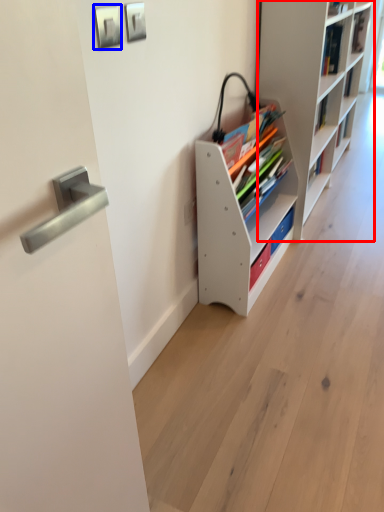
Question: Which object is further to the camera taking this photo, shelf (highlighted by a red box) or picture frame (highlighted by a blue box)?

Choices:
 (A) shelf
 (B) picture frame

Answer: (A)